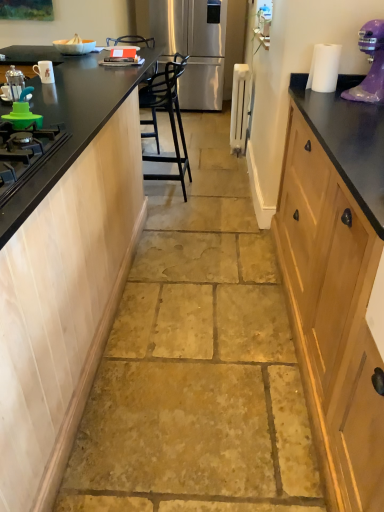
This screenshot has height=512, width=384. What do you see at coordinates (239, 106) in the screenshot?
I see `white metallic radiator at center, which is counted as the first appliance, starting from the top` at bounding box center [239, 106].

Identify the location of white glossy mug at upper left, the first appliance from the front. (44, 71).

Describe the element at coordinates (169, 117) in the screenshot. I see `black plastic chair at center` at that location.

Identify the location of black plastic chair at center. (169, 117).

This screenshot has height=512, width=384. I want to click on black matte gas stove at left, so click(x=25, y=155).

What do you see at coordinates (192, 46) in the screenshot? I see `stainless steel refrigerator at center` at bounding box center [192, 46].

Describe the element at coordinates (71, 123) in the screenshot. I see `black matte countertop at left` at that location.

The height and width of the screenshot is (512, 384). Identify the location of white metallic radiator at center, which is counted as the 1th appliance, starting from the right. click(x=239, y=106).

Is white glossy mug at upper left, the 1th appliance when ordered from bottom to top, bigger than brushed metal coffee press at left?

No, white glossy mug at upper left, the 1th appliance when ordered from bottom to top, is not bigger than brushed metal coffee press at left.

Is white glossy mug at upper left, the second appliance viewed from the back, not close to brushed metal coffee press at left?

No, white glossy mug at upper left, the second appliance viewed from the back, is in close proximity to brushed metal coffee press at left.

From a real-world perspective, is white glossy mug at upper left, the 1th appliance when ordered from bottom to top, above or below brushed metal coffee press at left?

white glossy mug at upper left, the 1th appliance when ordered from bottom to top, is situated lower than brushed metal coffee press at left in the real world.

Considering the relative sizes of white glossy mug at upper left, positioned as the second appliance in top-to-bottom order, and brushed metal coffee press at left in the image provided, is white glossy mug at upper left, positioned as the second appliance in top-to-bottom order, wider than brushed metal coffee press at left?

In fact, white glossy mug at upper left, positioned as the second appliance in top-to-bottom order, might be narrower than brushed metal coffee press at left.

Which of these two, black matte countertop at left or stainless steel refrigerator at center, stands taller?

stainless steel refrigerator at center.

From the image's perspective, is black matte countertop at left on stainless steel refrigerator at center?

No, from the image's perspective, black matte countertop at left is not on top of stainless steel refrigerator at center.

Is black matte countertop at left at the right side of stainless steel refrigerator at center?

No, black matte countertop at left is not to the right of stainless steel refrigerator at center.

Is the surface of black matte countertop at left in direct contact with stainless steel refrigerator at center?

No, black matte countertop at left is not next to stainless steel refrigerator at center.

Is white glossy mug at upper left, the 1th appliance when ordered from bottom to top, spatially inside black matte countertop at left, or outside of it?

white glossy mug at upper left, the 1th appliance when ordered from bottom to top, exists outside the volume of black matte countertop at left.

Is white glossy mug at upper left, the second appliance viewed from the back, turned away from black matte countertop at left?

No, white glossy mug at upper left, the second appliance viewed from the back,'s orientation is not away from black matte countertop at left.

Can you confirm if white glossy mug at upper left, the second appliance viewed from the back, is smaller than black matte countertop at left?

Yes.

From the image's perspective, is white glossy mug at upper left, positioned as the second appliance in top-to-bottom order, under black matte countertop at left?

Indeed, from the image's perspective, white glossy mug at upper left, positioned as the second appliance in top-to-bottom order, is shown beneath black matte countertop at left.

Considering the sizes of objects purple plastic stand mixer at upper right and white glossy mug at upper left, positioned as the second appliance in top-to-bottom order, in the image provided, who is thinner, purple plastic stand mixer at upper right or white glossy mug at upper left, positioned as the second appliance in top-to-bottom order,?

Thinner between the two is white glossy mug at upper left, positioned as the second appliance in top-to-bottom order.

Could you tell me if purple plastic stand mixer at upper right is turned towards white glossy mug at upper left, positioned as the second appliance in top-to-bottom order?

No.

In the scene shown: Is purple plastic stand mixer at upper right completely or partially outside of white glossy mug at upper left, the first appliance from the front?

Indeed, purple plastic stand mixer at upper right is completely outside white glossy mug at upper left, the first appliance from the front.

How far apart are purple plastic stand mixer at upper right and white glossy mug at upper left, the second appliance viewed from the back?

1.62 meters.

How many degrees apart are the facing directions of stainless steel refrigerator at center and white glossy mug at upper left, the second appliance viewed from the back?

The angular difference between stainless steel refrigerator at center and white glossy mug at upper left, the second appliance viewed from the back, is 91.6 degrees.

Does point (198, 59) lie in front of point (51, 72)?

No, (198, 59) is further to viewer.

From the picture: Which object is thinner, stainless steel refrigerator at center or white glossy mug at upper left, the 1th appliance in the left-to-right sequence?

white glossy mug at upper left, the 1th appliance in the left-to-right sequence.

Considering the relative sizes of stainless steel refrigerator at center and white glossy mug at upper left, the 1th appliance when ordered from bottom to top, in the image provided, is stainless steel refrigerator at center shorter than white glossy mug at upper left, the 1th appliance when ordered from bottom to top,?

In fact, stainless steel refrigerator at center may be taller than white glossy mug at upper left, the 1th appliance when ordered from bottom to top.

Between black plastic chair at center and black matte countertop at left, which one is positioned behind?

black matte countertop at left is behind.

Is black plastic chair at center looking in the opposite direction of black matte countertop at left?

That's not correct — black plastic chair at center is not looking away from black matte countertop at left.

Is black matte countertop at left with white paper at upper right?

black matte countertop at left and white paper at upper right are clearly separated.

Do you think black matte countertop at left is within white paper at upper right, or outside of it?

black matte countertop at left is spatially situated outside white paper at upper right.

Between black matte countertop at left and white paper at upper right, which one appears on the right side from the viewer's perspective?

white paper at upper right is more to the right.

The height and width of the screenshot is (512, 384). I want to click on countertop below the white paper at upper right (from a real-world perspective), so click(x=71, y=123).

What are the coordinates of `kitchen appliance located above the white glossy mug at upper left, the 1th appliance in the left-to-right sequence (from a real-world perspective)` in the screenshot? It's located at (15, 83).

Locate an element on the screen. countertop on the left of stainless steel refrigerator at center is located at coordinates (71, 123).

Considering their positions, is black plastic chair at center positioned closer to white metallic radiator at center, the 1th appliance in the back-to-front sequence, than stainless steel refrigerator at center?

black plastic chair at center is positioned closer to the anchor white metallic radiator at center, the 1th appliance in the back-to-front sequence.

From the picture: Estimate the real-world distances between objects in this image. Which object is closer to black matte countertop at left, white paper at upper right or stainless steel refrigerator at center?

white paper at upper right is positioned closer to the anchor black matte countertop at left.

Based on their spatial positions, is black matte gas stove at left or stainless steel refrigerator at center further from white metallic radiator at center, acting as the second appliance starting from the left?

black matte gas stove at left is further to white metallic radiator at center, acting as the second appliance starting from the left.

When comparing their distances from black plastic chair at center, does white glossy mug at upper left, the 1th appliance when ordered from bottom to top, or black matte countertop at left seem closer?

black matte countertop at left is closer to black plastic chair at center.

Based on their spatial positions, is purple plastic stand mixer at upper right or white metallic radiator at center, the second appliance viewed from the front, closer to black plastic chair at center?

white metallic radiator at center, the second appliance viewed from the front, is closer to black plastic chair at center.

Looking at the image, which one is located closer to black matte countertop at left, black plastic chair at center or white glossy mug at upper left, the 1th appliance in the left-to-right sequence?

white glossy mug at upper left, the 1th appliance in the left-to-right sequence, is positioned closer to the anchor black matte countertop at left.

Based on their spatial positions, is white metallic radiator at center, which is counted as the 1th appliance, starting from the right, or black matte gas stove at left closer to brushed metal coffee press at left?

black matte gas stove at left is positioned closer to the anchor brushed metal coffee press at left.

Looking at this image, considering their positions, is black matte countertop at left positioned further to purple plastic stand mixer at upper right than black matte gas stove at left?

black matte gas stove at left lies further to purple plastic stand mixer at upper right than the other object.

I want to click on chair between black matte countertop at left and purple plastic stand mixer at upper right from left to right, so click(169, 117).

At what (x,y) coordinates should I click in order to perform the action: click on chair between purple plastic stand mixer at upper right and stainless steel refrigerator at center along the z-axis. Please return your answer as a coordinate pair (x, y). Looking at the image, I should click on (169, 117).

Identify the location of chair positioned between brushed metal coffee press at left and black matte countertop at left from near to far. (169, 117).

What are the coordinates of `paper towel between black matte gas stove at left and black matte countertop at left along the z-axis` in the screenshot? It's located at (324, 68).